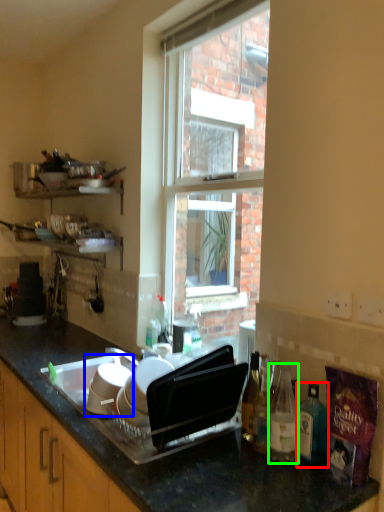
Question: Which is nearer to the bottle (highlighted by a red box)? appliance (highlighted by a blue box) or bottle (highlighted by a green box).

Choices:
 (A) appliance
 (B) bottle

Answer: (B)